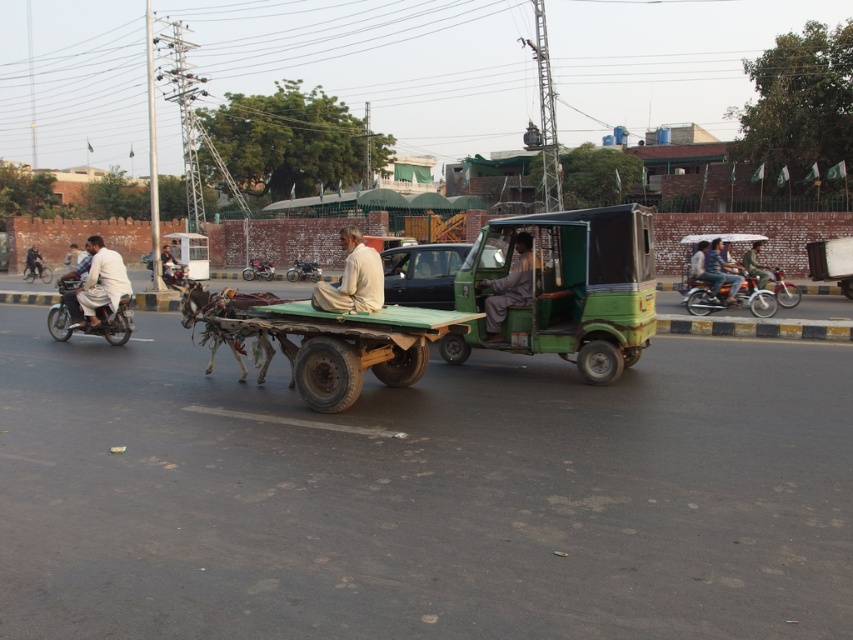
Question: Is matte green tuk-tuk at center positioned in front of jeans at center?

Choices:
 (A) yes
 (B) no

Answer: (A)

Question: Which object appears farthest from the camera in this image?

Choices:
 (A) jeans at center
 (B) dark brown leather jacket at left
 (C) light brown fabric pants at left
 (D) matte green tuk-tuk at center

Answer: (B)

Question: Can you confirm if green wooden wagon at center is thinner than light brown leather jacket at center?

Choices:
 (A) no
 (B) yes

Answer: (B)

Question: Considering the relative positions of green wooden wagon at center and light brown fabric pants at left in the image provided, where is green wooden wagon at center located with respect to light brown fabric pants at left?

Choices:
 (A) below
 (B) above

Answer: (A)

Question: Which point is farther to the camera?

Choices:
 (A) dark blue jeans at center
 (B) light brown leather jacket at center
 (C) green fabric jacket at center

Answer: (B)

Question: Which of the following is the farthest from the observer?

Choices:
 (A) (706, 244)
 (B) (706, 264)

Answer: (A)